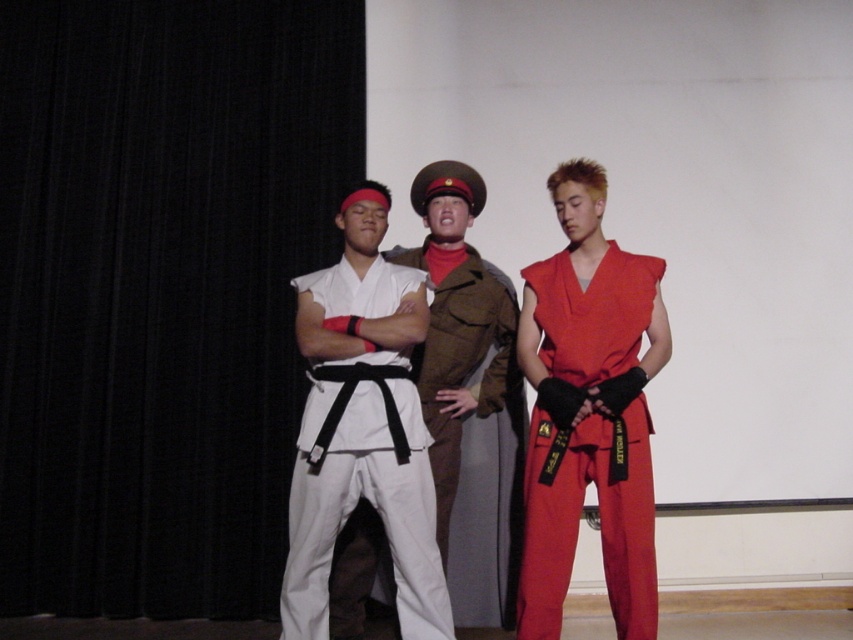
Can you confirm if white matte karate uniform at center is thinner than matte red jumpsuit at right?

No, white matte karate uniform at center is not thinner than matte red jumpsuit at right.

Who is more forward, (306, 556) or (554, 298)?

Point (306, 556) is in front.

Is point (315, 372) farther from viewer compared to point (604, 310)?

That is False.

Find the location of a particular element. The height and width of the screenshot is (640, 853). white matte karate uniform at center is located at coordinates pyautogui.click(x=363, y=428).

Is point (639, 410) positioned behind point (448, 172)?

No, it is in front of (448, 172).

From the picture: Who is higher up, matte red jumpsuit at right or brown woolen uniform at center?

Result: brown woolen uniform at center is above.

Locate an element on the screen. matte red jumpsuit at right is located at coordinates (578, 518).

Is white matte karate uniform at center positioned in front of brown woolen uniform at center?

Yes, white matte karate uniform at center is closer to the viewer.

Does white matte karate uniform at center have a lesser width compared to brown woolen uniform at center?

Answer: Incorrect, white matte karate uniform at center's width is not less than brown woolen uniform at center's.

Does point (338, 513) lie behind point (396, 260)?

No, (338, 513) is in front of (396, 260).

Find the location of a particular element. The width and height of the screenshot is (853, 640). white matte karate uniform at center is located at coordinates (363, 428).